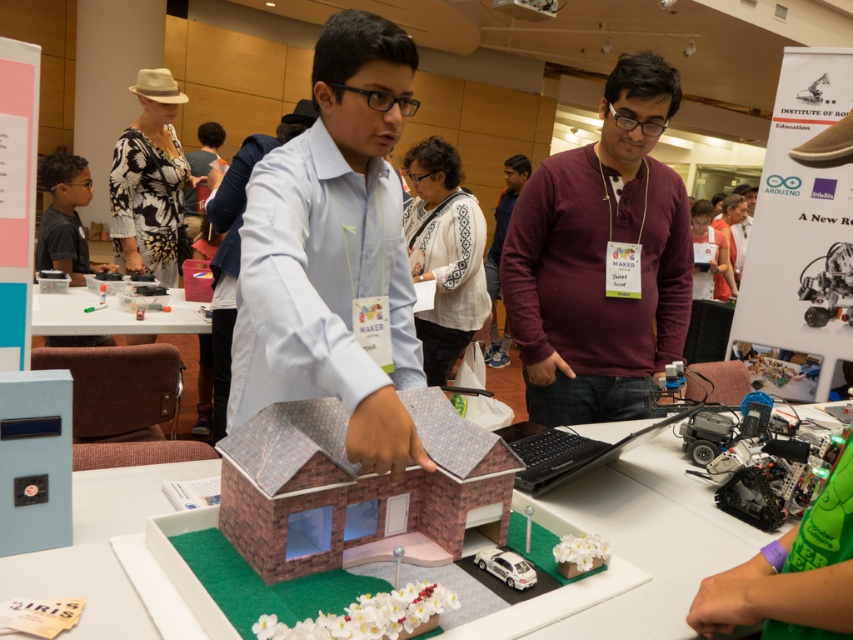
You are a participant in the robotics workshop and need to place a small electronic component on the table. Can you place it directly behind the maroon sweater at center on the white plastic table at center?

The maroon sweater at center is in front of the white plastic table at center, so placing the component directly behind the maroon sweater at center on the white plastic table at center would be possible as the sweater is positioned over the table.

Based on the scene description, where is the maroon sweater at center located in terms of coordinates?

The maroon sweater at center is located at coordinates point (601, 259).